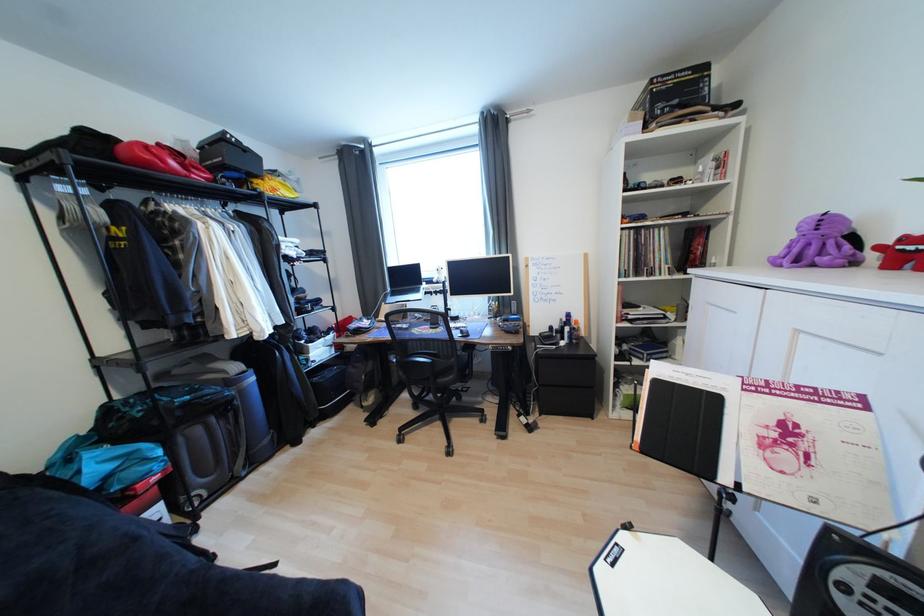
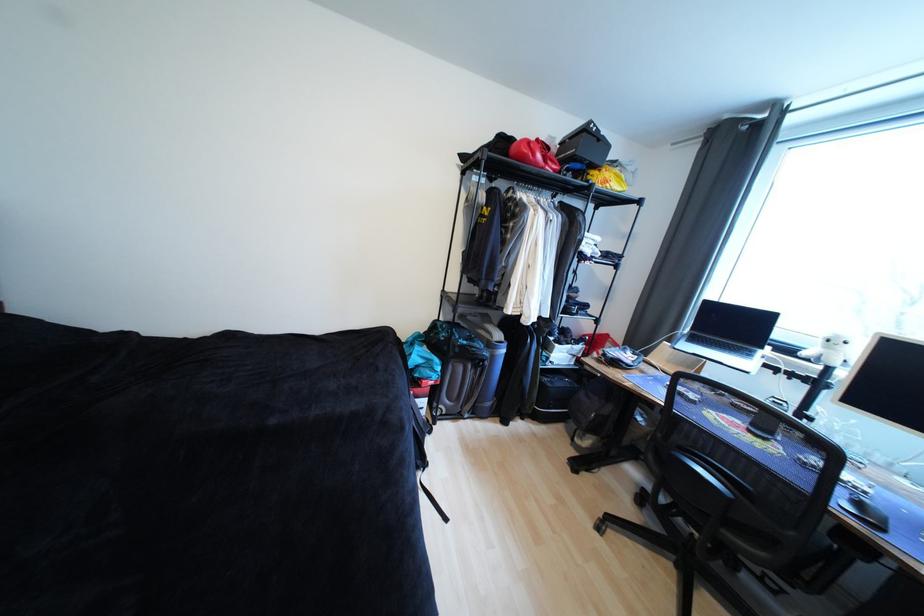
Locate, in the second image, the point that corresponds to pixel 152 166 in the first image.

(529, 159)